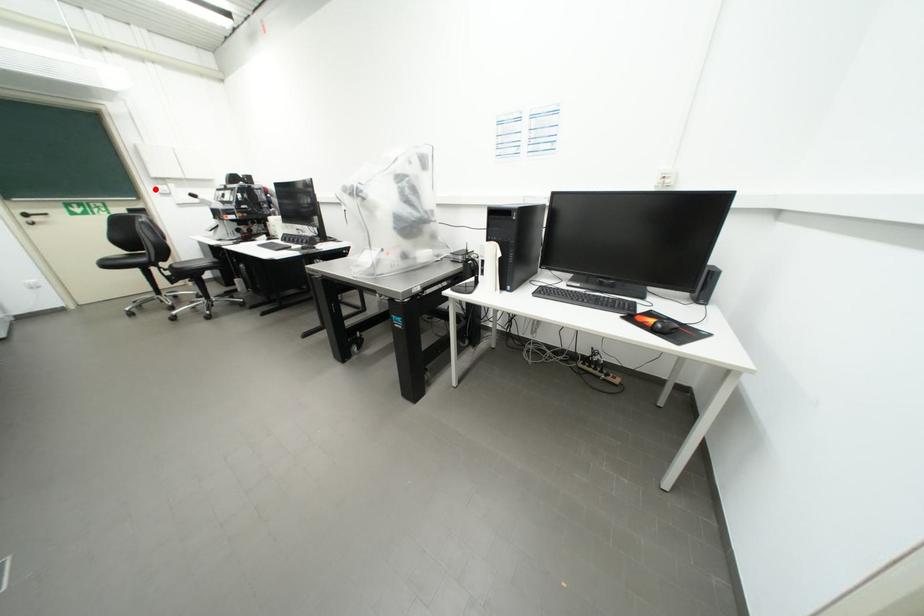
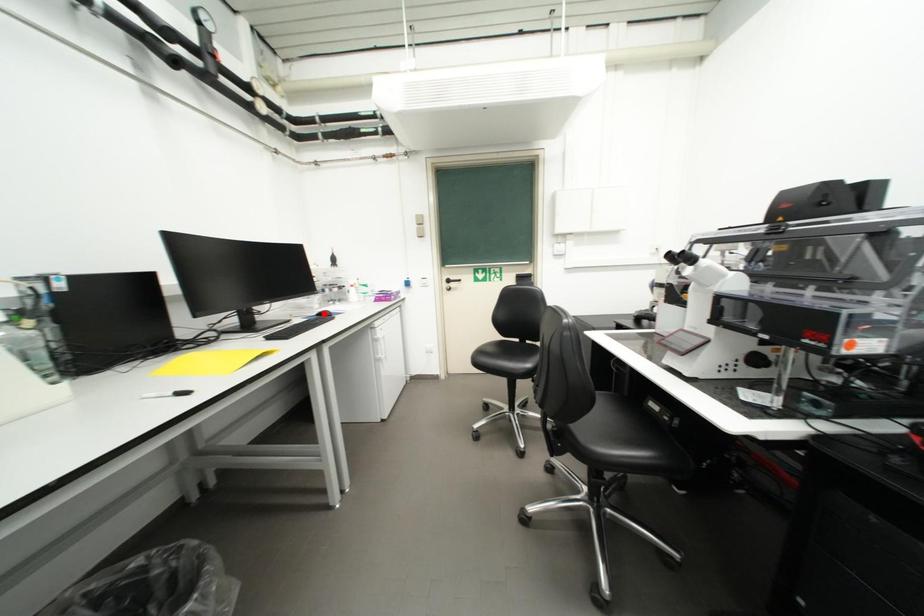
I am providing you with two images of the same scene from different viewpoints. A red point is marked on the first image and another point is marked on the second image. Is the marked point in image1 the same physical position as the marked point in image2?

No